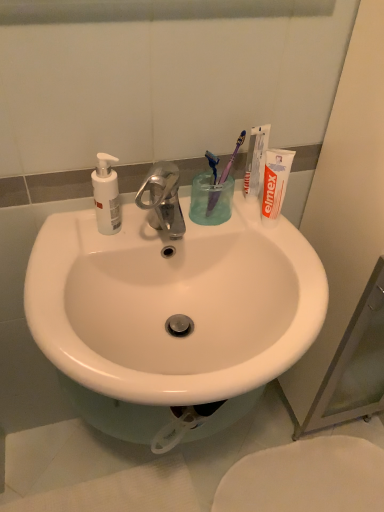
You are a GUI agent. You are given a task and a screenshot of the screen. Output one action in this format:
    pyautogui.click(x=<x>, y=<y>)
    Task: Click on the free space in front of purple plastic toothbrush at upper right, the 1th toothbrush in the right-to-left sequence
    The height and width of the screenshot is (512, 384).
    Given the screenshot: What is the action you would take?
    point(255,237)